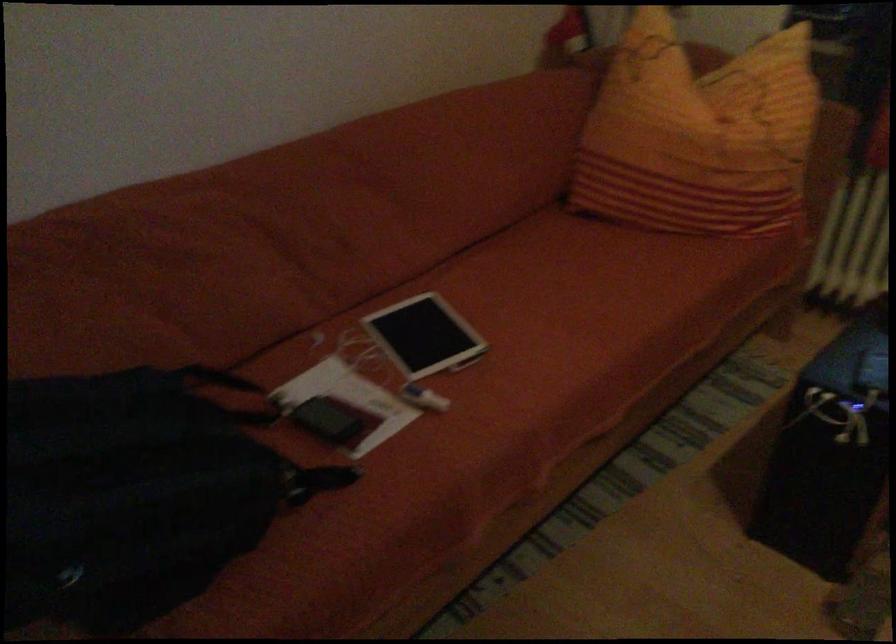
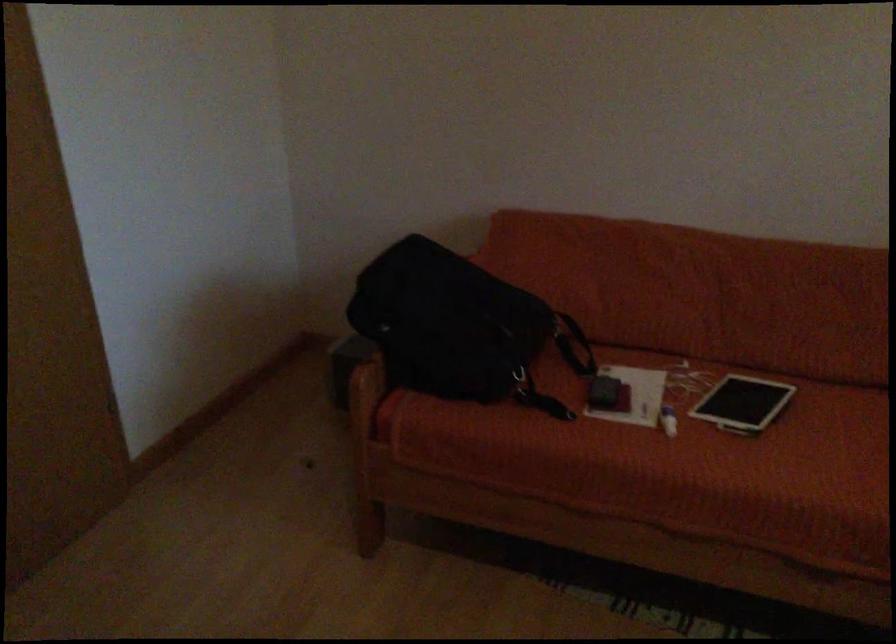
Question: I am providing you with two images of the same scene from different viewpoints. After the viewpoint changes to image2, which objects are now occluded?

Choices:
 (A) small black tablet
 (B) black bag
 (C) bag strap
 (D) none of these

Answer: (D)